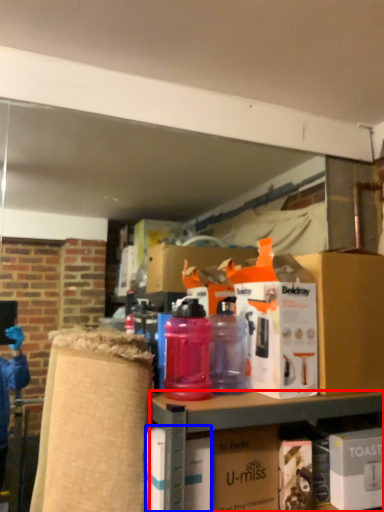
Question: Which object is further to the camera taking this photo, cabinetry (highlighted by a red box) or box (highlighted by a blue box)?

Choices:
 (A) cabinetry
 (B) box

Answer: (B)